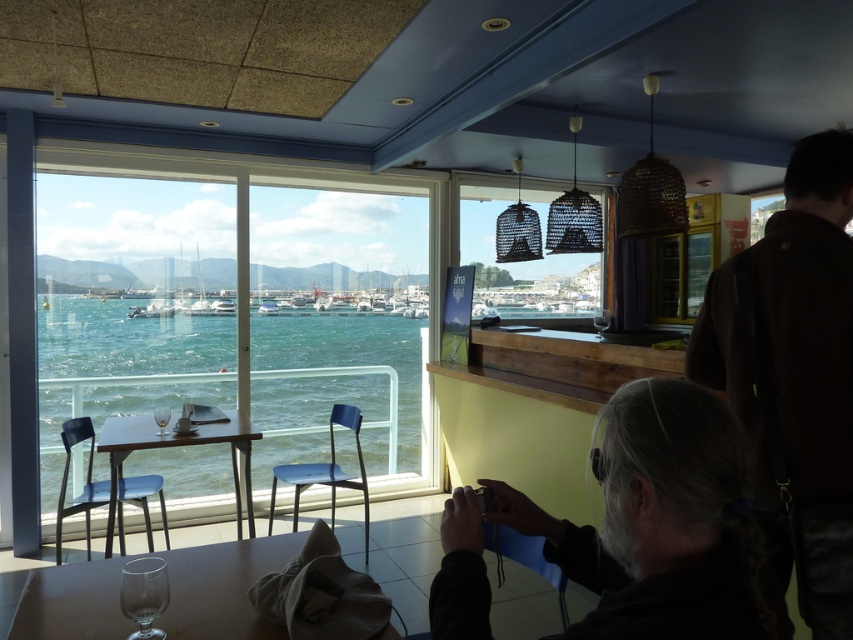
You are a customer sitting at a table in the middle of the room. You notice the dark brown leather jacket at upper right and the teal glossy water at lower left. Which object is positioned more to the east side of the room?

The dark brown leather jacket at upper right is positioned more to the east side of the room since it is to the right of the teal glossy water at lower left, and the windows with the marina view are on the side facing east.

You are a customer sitting at a table in the cafe and want to look at both the dark brown leather jacket at upper right and the teal glossy water at lower left. Which object will appear larger in your view?

The dark brown leather jacket at upper right is closer to the viewer than the teal glossy water at lower left, so it will appear larger in your view.

You are a customer sitting at the center of the cafe. You notice two items at the center of the room. Which one is thinner, the gray hair at center or the woven wood lanterns at center?

The gray hair at center is thinner than the woven wood lanterns at center.